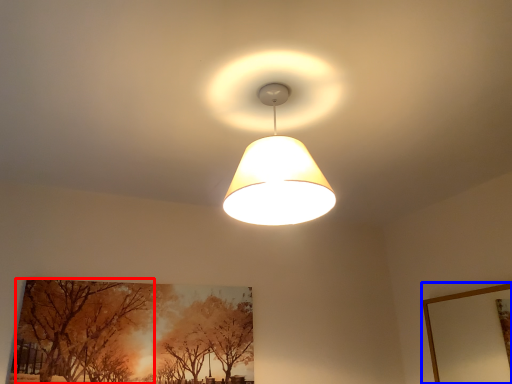
Question: Which point is closer to the camera, tree (highlighted by a red box) or picture frame (highlighted by a blue box)?

Choices:
 (A) tree
 (B) picture frame

Answer: (B)